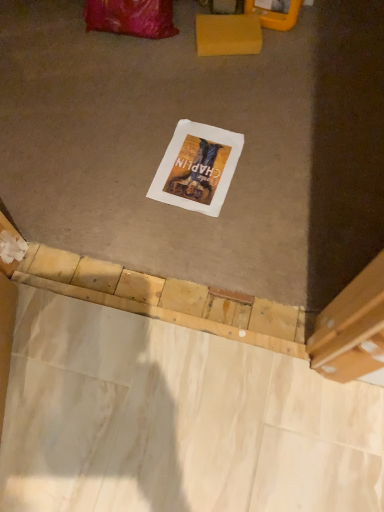
I want to click on empty space that is ontop of white paper flyer at center (from a real-world perspective), so click(190, 162).